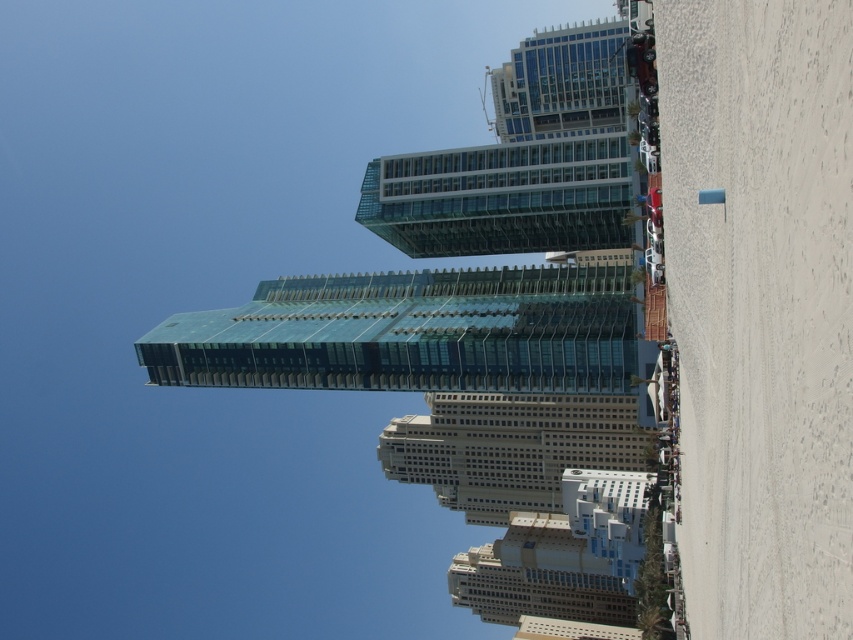
You are a drone operator flying a drone that needs to capture aerial footage of the transparent glass tower at center and the beige stone building at center. Based on their positions, which one will appear larger in the camera frame?

The transparent glass tower at center will appear larger in the camera frame because it is positioned in front of the beige stone building at center, making it closer to the drone camera.